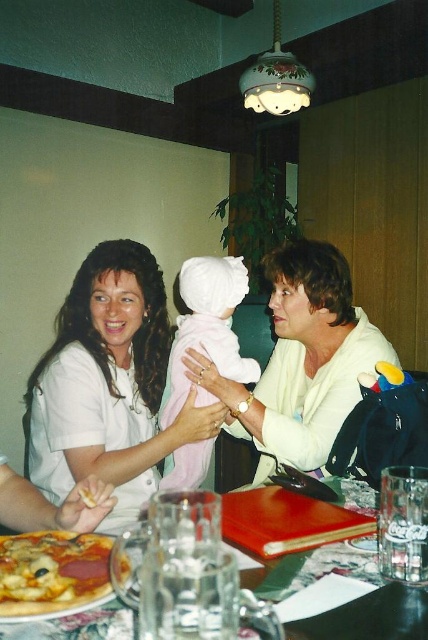
You are sitting at the table and want to reach both the point at coordinates (100,360) and the point at coordinates (74,550). Which point is closer to you?

The point at coordinates (100,360) is closer to you because it is further to the viewer than the point at coordinates (74,550).

You are a waiter in a busy restaurant and need to quickly deliver a drink to a customer seated at the table. The customer is pointing to the golden crispy pizza at lower left and the matte plastic plate at lower left. They want the drink placed as close as possible to the pizza without touching it. Where should you place the drink?

Place the drink to the right of the golden crispy pizza at lower left, near the matte plastic plate at lower left since the pizza is to the left of the plate.